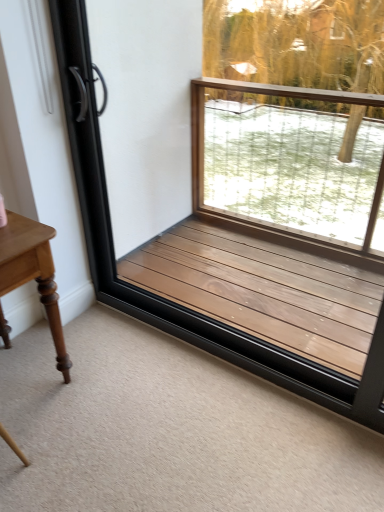
Where is `vacant region under light brown wood table at left (from a real-world perspective)`? The height and width of the screenshot is (512, 384). vacant region under light brown wood table at left (from a real-world perspective) is located at coordinates (27, 381).